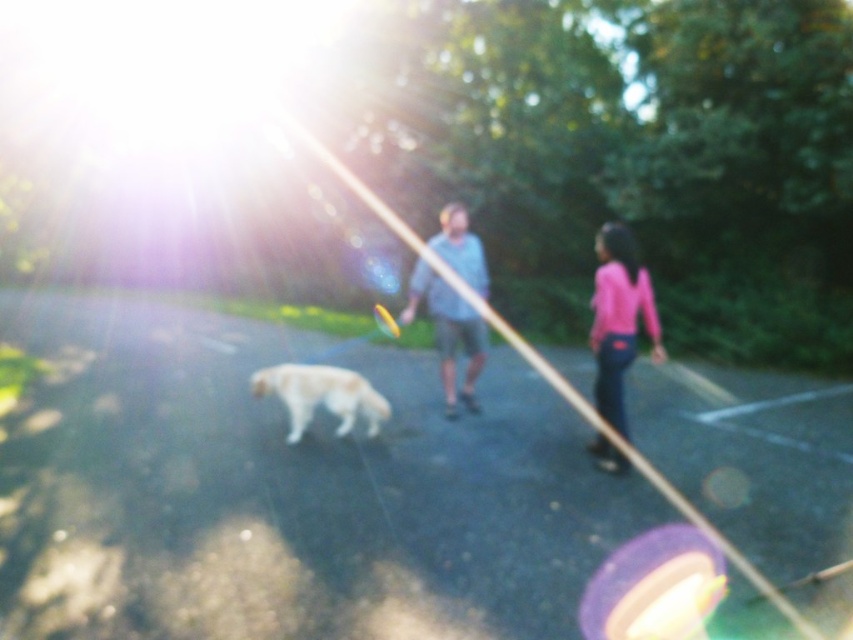
In the scene shown: You are a photographer trying to capture a photo of the golden fur dog at center and the pink matte shirt at right. Based on their heights, which one should you focus on first to ensure both are in frame?

A: The pink matte shirt at right is much taller than the golden fur dog at center, so you should focus on the pink matte shirt at right first to ensure both are in frame.

You are a photographer trying to capture the light blue fabric shirt at center and the golden fur dog at center in the same frame. Based on their sizes, which one will appear bigger in the photo?

The light blue fabric shirt at center is larger in size than the golden fur dog at center, so it will appear bigger in the photo.